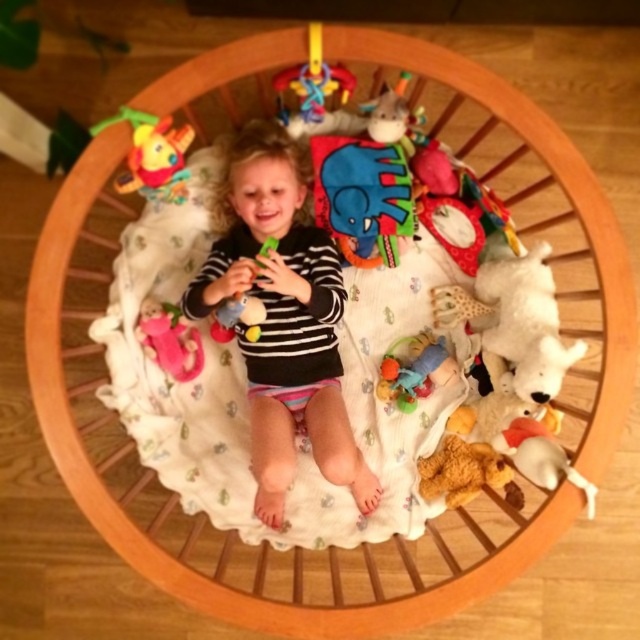
Does white plush toy at lower right have a smaller size compared to pink fabric doll at lower left?

No.

Which of these two, white plush toy at lower right or pink fabric doll at lower left, stands taller?

With more height is pink fabric doll at lower left.

Which is behind, point (532, 468) or point (164, 339)?

Point (164, 339)

In order to click on white plush toy at lower right in this screenshot , I will do `click(540, 456)`.

Does blue felt elephant at center have a lesser width compared to plush yellow duck at upper left?

In fact, blue felt elephant at center might be wider than plush yellow duck at upper left.

Is blue felt elephant at center taller than plush yellow duck at upper left?

Yes, blue felt elephant at center is taller than plush yellow duck at upper left.

Which is behind, point (339, 244) or point (170, 138)?

The point (339, 244) is more distant.

Locate an element on the screen. This screenshot has width=640, height=640. blue felt elephant at center is located at coordinates (362, 196).

Which is below, blue felt elephant at center or soft plush bear at center?

soft plush bear at center is lower down.

Looking at this image, is blue felt elephant at center positioned before soft plush bear at center?

That is False.

Image resolution: width=640 pixels, height=640 pixels. Find the location of `blue felt elephant at center`. blue felt elephant at center is located at coordinates (362, 196).